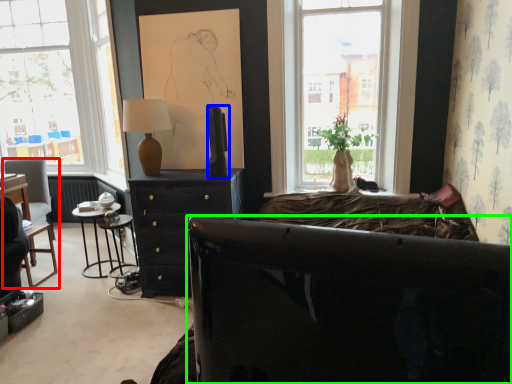
Question: Based on their relative distances, which object is nearer to chair (highlighted by a red box)? Choose from television (highlighted by a blue box) and studio couch (highlighted by a green box).

Choices:
 (A) television
 (B) studio couch

Answer: (A)